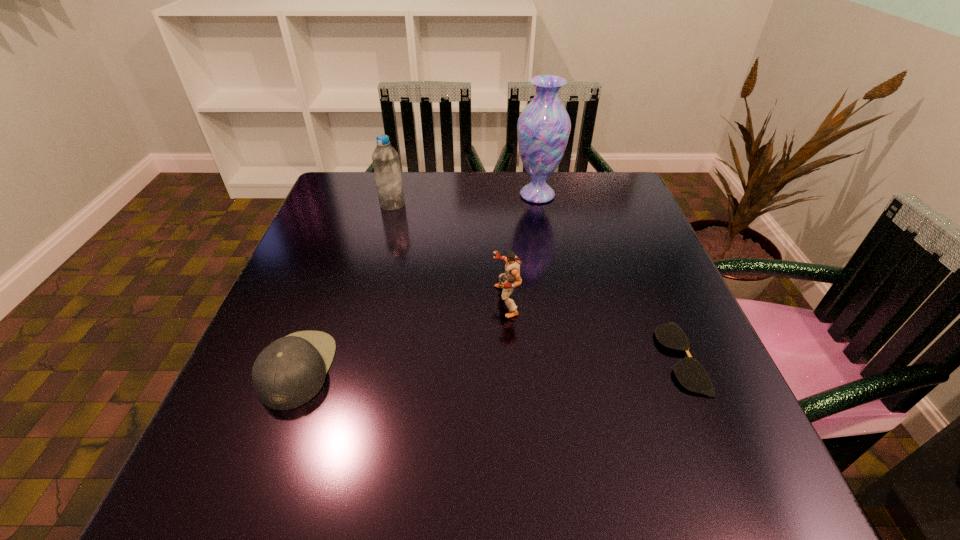
I want to click on free point between the second shortest object and the water bottle, so click(345, 287).

Find the location of `free space between the water bottle and the tallest object`. free space between the water bottle and the tallest object is located at coordinates (465, 200).

At what (x,y) coordinates should I click in order to perform the action: click on free spot between the cap and the water bottle. Please return your answer as a coordinate pair (x, y). This screenshot has height=540, width=960. Looking at the image, I should click on (345, 287).

The image size is (960, 540). Identify the location of vacant space in between the shortest object and the puncher. (592, 329).

Where is `empty location between the second tallest object and the spectacles`? This screenshot has height=540, width=960. empty location between the second tallest object and the spectacles is located at coordinates (536, 281).

This screenshot has height=540, width=960. Identify the location of free spot between the spectacles and the fourth shortest object. (536, 281).

Locate an element on the screen. vacant point located between the rightmost object and the fourth tallest object is located at coordinates (489, 363).

Identify the location of free area in between the second tallest object and the third farthest object. This screenshot has width=960, height=540. (449, 253).

Where is `object that can be found as the fourth closest to the second tallest object`? object that can be found as the fourth closest to the second tallest object is located at coordinates (690, 373).

Point out which object is positioned as the third nearest to the second shortest object. Please provide its 2D coordinates. Your answer should be formatted as a tuple, i.e. [(x, y)], where the tuple contains the x and y coordinates of a point satisfying the conditions above.

[(543, 128)]